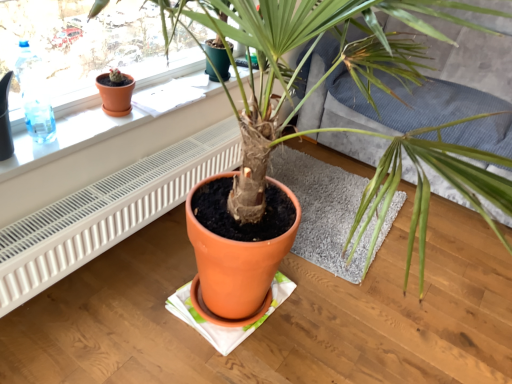
The width and height of the screenshot is (512, 384). I want to click on free space in front of terracotta pot at center, so click(326, 325).